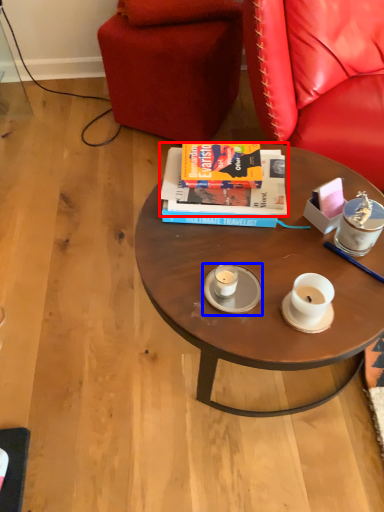
Question: Which object is closer to the camera taking this photo, book (highlighted by a red box) or saucer (highlighted by a blue box)?

Choices:
 (A) book
 (B) saucer

Answer: (B)